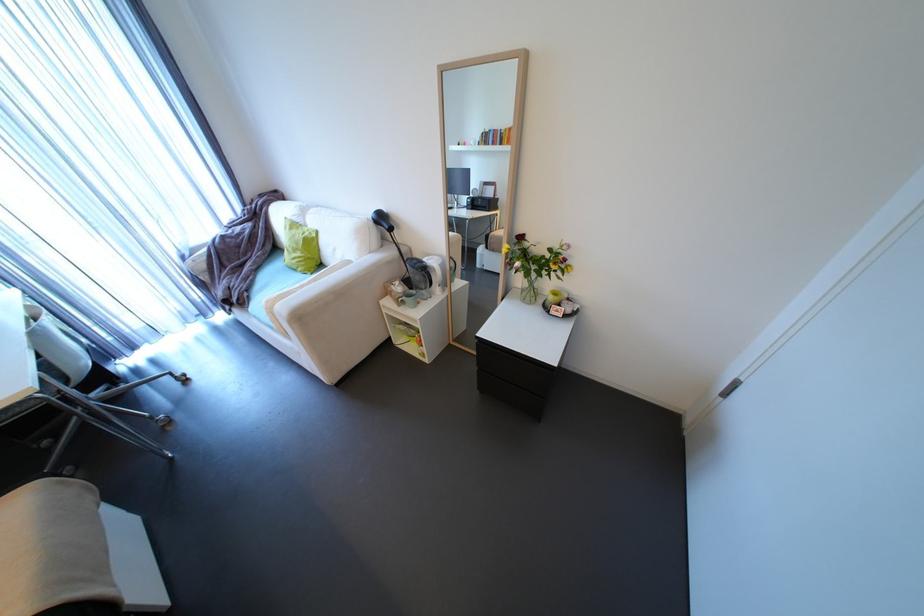
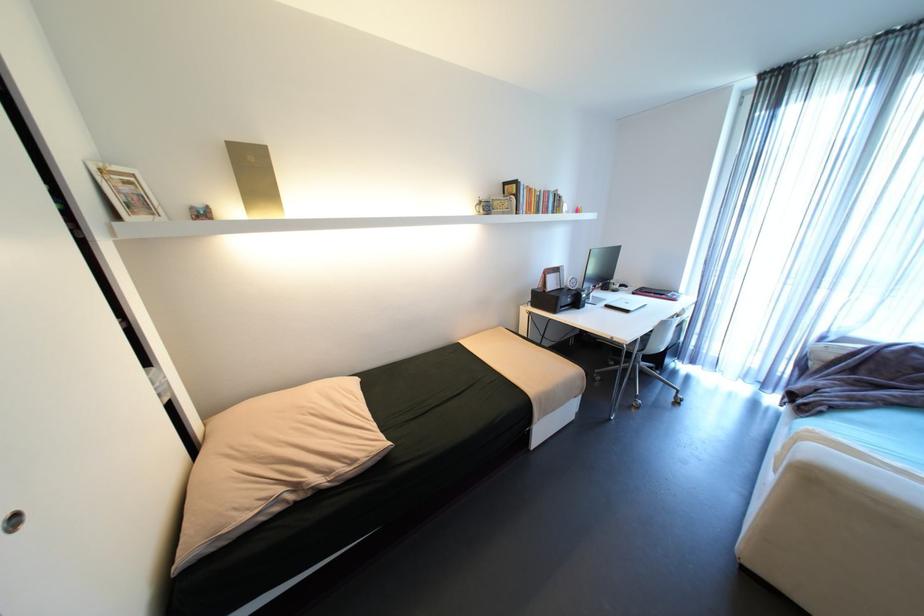
The first image is from the beginning of the video and the second image is from the end. How did the camera likely rotate when shooting the video?

The rotation direction of the camera is left-down.